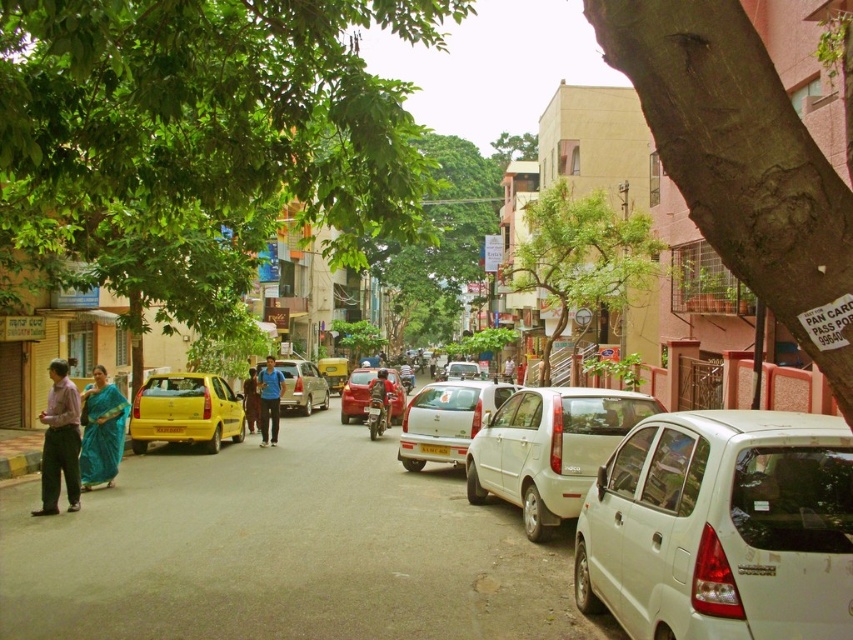
Question: Which point is farther to the camera?

Choices:
 (A) white matte car at right
 (B) white matte hatchback at center
 (C) blue silk saree at lower left

Answer: (C)

Question: Does blue silk saree at lower left have a greater width compared to shiny red car at center?

Choices:
 (A) yes
 (B) no

Answer: (B)

Question: Is brown rough bark at upper right above blue silk saree at lower left?

Choices:
 (A) yes
 (B) no

Answer: (A)

Question: Which point is closer to the camera taking this photo?

Choices:
 (A) (447, 424)
 (B) (165, 408)
 (C) (392, 413)

Answer: (A)

Question: Does green leafy tree at center have a greater width compared to blue fabric dress at center?

Choices:
 (A) yes
 (B) no

Answer: (A)

Question: Among these objects, which one is nearest to the camera?

Choices:
 (A) green leafy tree at center
 (B) brown rough bark at upper right

Answer: (B)